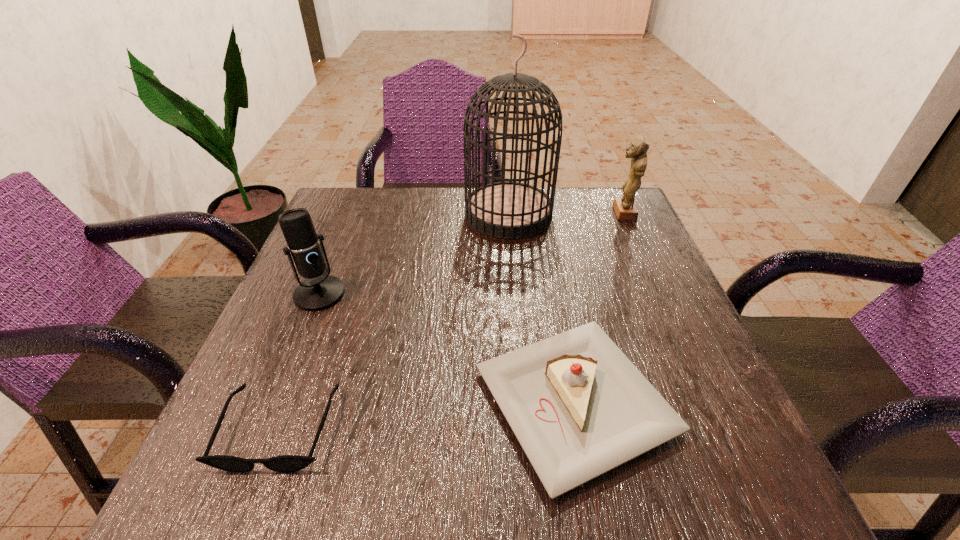
Where is `birdcage`? Image resolution: width=960 pixels, height=540 pixels. birdcage is located at coordinates (507, 210).

Where is `figurine`? figurine is located at coordinates click(x=625, y=209).

The height and width of the screenshot is (540, 960). What are the coordinates of `the third farthest object` in the screenshot? It's located at (319, 291).

Where is `the fourth tallest object`? This screenshot has width=960, height=540. the fourth tallest object is located at coordinates (579, 408).

In order to click on sunglasses in this screenshot , I will do `click(285, 463)`.

This screenshot has width=960, height=540. I want to click on blank space located on the left of the birdcage, so click(340, 214).

I want to click on blank area located on the front-facing side of the figurine, so (x=514, y=213).

Find the location of a particular element. vacant space located 0.270m on the front-facing side of the figurine is located at coordinates (506, 213).

Find the location of a particular element. This screenshot has width=960, height=540. free spot located 0.360m on the front-facing side of the figurine is located at coordinates 470,213.

Image resolution: width=960 pixels, height=540 pixels. What are the coordinates of `blank area located on the front of the third farthest object` in the screenshot? It's located at (283, 384).